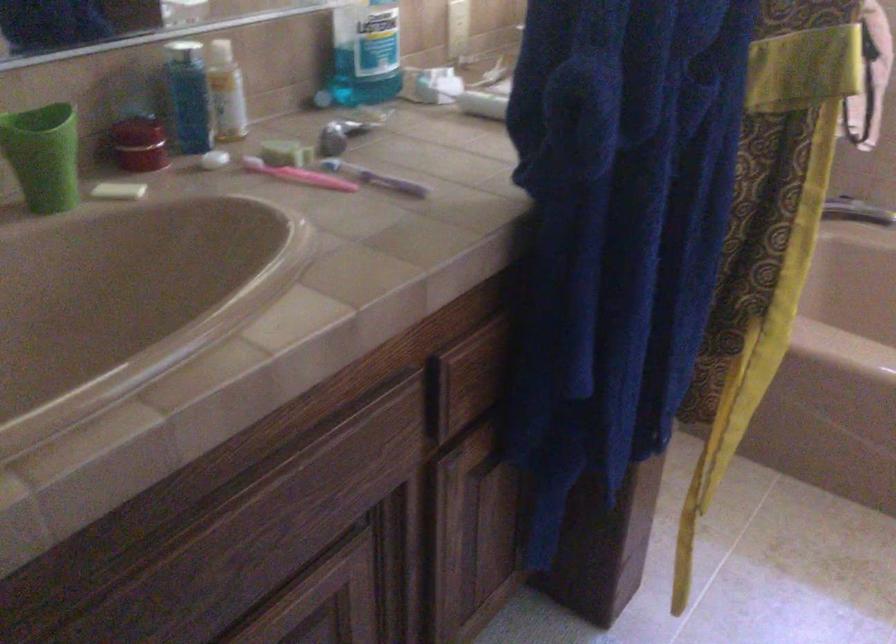
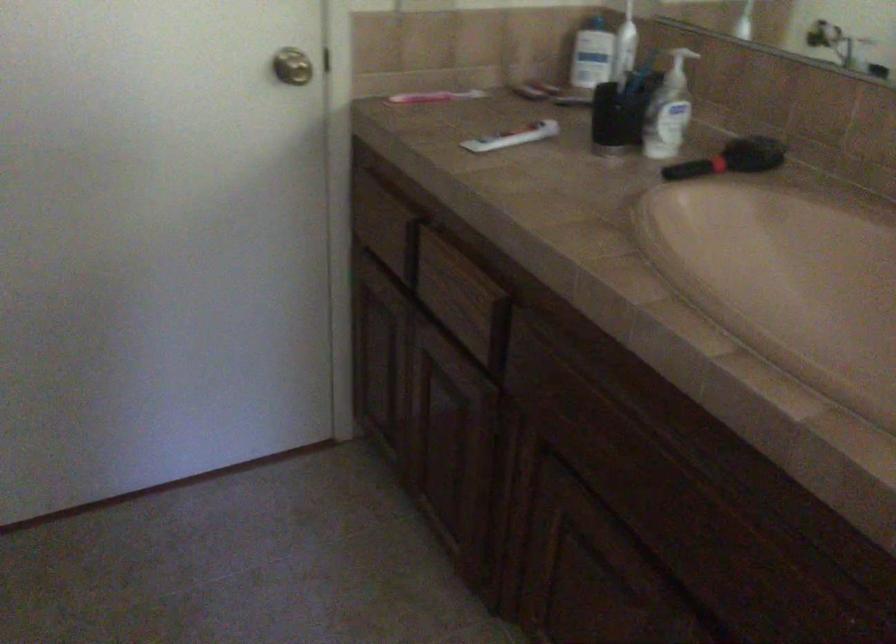
The first image is from the beginning of the video and the second image is from the end. How did the camera likely rotate when shooting the video?

The camera's rotation is toward left-down.